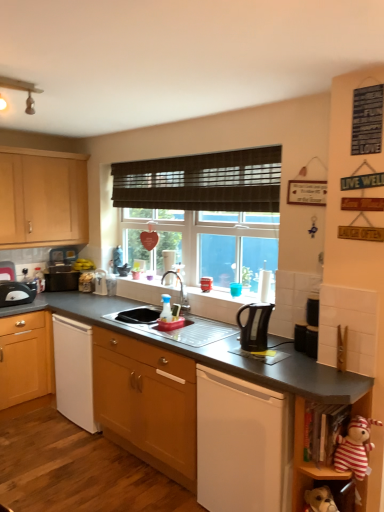
Question: Is brown woven blind at center to the left of black plastic kettle at center, the first appliance when ordered from front to back, from the viewer's perspective?

Choices:
 (A) yes
 (B) no

Answer: (A)

Question: From the image's perspective, does brown woven blind at center appear lower than black plastic kettle at center, placed as the second appliance when sorted from back to front?

Choices:
 (A) yes
 (B) no

Answer: (B)

Question: Considering the relative sizes of brown woven blind at center and black plastic kettle at center, placed as the second appliance when sorted from back to front, in the image provided, is brown woven blind at center taller than black plastic kettle at center, placed as the second appliance when sorted from back to front,?

Choices:
 (A) no
 (B) yes

Answer: (B)

Question: Is brown woven blind at center aimed at black plastic kettle at center, placed as the second appliance when sorted from back to front?

Choices:
 (A) no
 (B) yes

Answer: (A)

Question: From a real-world perspective, is brown woven blind at center physically below black plastic kettle at center, placed as the second appliance when sorted from back to front?

Choices:
 (A) yes
 (B) no

Answer: (B)

Question: Does brown woven blind at center lie behind black plastic kettle at center, which ranks as the second appliance in left-to-right order?

Choices:
 (A) yes
 (B) no

Answer: (A)

Question: Is striped fabric stuffed animal at lower right, which is the 1th shelf from bottom to top, looking in the opposite direction of black plastic toaster at left, positioned as the 1th appliance in top-to-bottom order?

Choices:
 (A) no
 (B) yes

Answer: (A)

Question: From a real-world perspective, is striped fabric stuffed animal at lower right, which ranks as the 2th shelf in top-to-bottom order, on top of black plastic toaster at left, which is counted as the first appliance, starting from the back?

Choices:
 (A) yes
 (B) no

Answer: (B)

Question: Is striped fabric stuffed animal at lower right, which is the 1th shelf from bottom to top, not within black plastic toaster at left, acting as the 2th appliance starting from the bottom?

Choices:
 (A) yes
 (B) no

Answer: (A)

Question: Is striped fabric stuffed animal at lower right, which ranks as the 2th shelf in top-to-bottom order, aimed at black plastic toaster at left, acting as the 2th appliance starting from the bottom?

Choices:
 (A) yes
 (B) no

Answer: (B)

Question: From the image's perspective, is striped fabric stuffed animal at lower right, which ranks as the 2th shelf in top-to-bottom order, under black plastic toaster at left, positioned as the 1th appliance in top-to-bottom order?

Choices:
 (A) yes
 (B) no

Answer: (A)

Question: Is striped fabric stuffed animal at lower right, which ranks as the 2th shelf in top-to-bottom order, touching black plastic toaster at left, acting as the 2th appliance starting from the bottom?

Choices:
 (A) no
 (B) yes

Answer: (A)

Question: Is striped fabric stuffed animal at lower right, which ranks as the 2th shelf in top-to-bottom order, bigger than black plastic toaster at left, which ranks as the 2th kitchen appliance in right-to-left order?

Choices:
 (A) no
 (B) yes

Answer: (A)